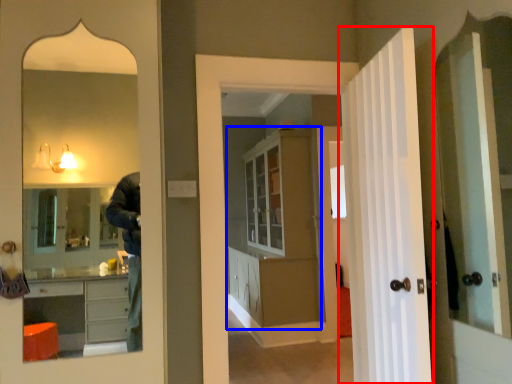
Question: Among these objects, which one is nearest to the camera, door (highlighted by a red box) or dresser (highlighted by a blue box)?

Choices:
 (A) door
 (B) dresser

Answer: (A)